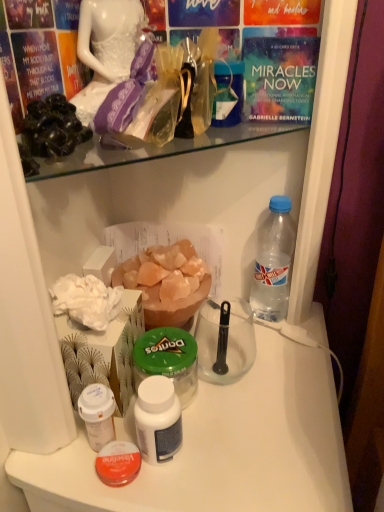
Question: From the image's perspective, is pink crystal salt at center above or below white plastic bottle at center, the 3th bottle positioned from the right?

Choices:
 (A) above
 (B) below

Answer: (A)

Question: Is point (178, 296) positioned closer to the camera than point (155, 392)?

Choices:
 (A) farther
 (B) closer

Answer: (A)

Question: Which of these objects is positioned closest to the black matte rock at upper left?

Choices:
 (A) clear plastic bottle at right, the first bottle when ordered from right to left
 (B) pink crystal salt at center
 (C) white plastic cup at lower left, the first bottle when ordered from left to right
 (D) white plastic bottle at center, the 3th bottle positioned from the right
 (E) white plastic table at center

Answer: (B)

Question: Which of these objects is positioned closest to the white plastic table at center?

Choices:
 (A) white plastic bottle at center, which is the second bottle from left to right
 (B) white plastic cup at lower left, arranged as the 4th bottle when viewed from the right
 (C) clear plastic bottle at right, which ranks as the 4th bottle in left-to-right order
 (D) green plastic jar at center, arranged as the 2th bottle when viewed from the right
 (E) black matte rock at upper left

Answer: (D)